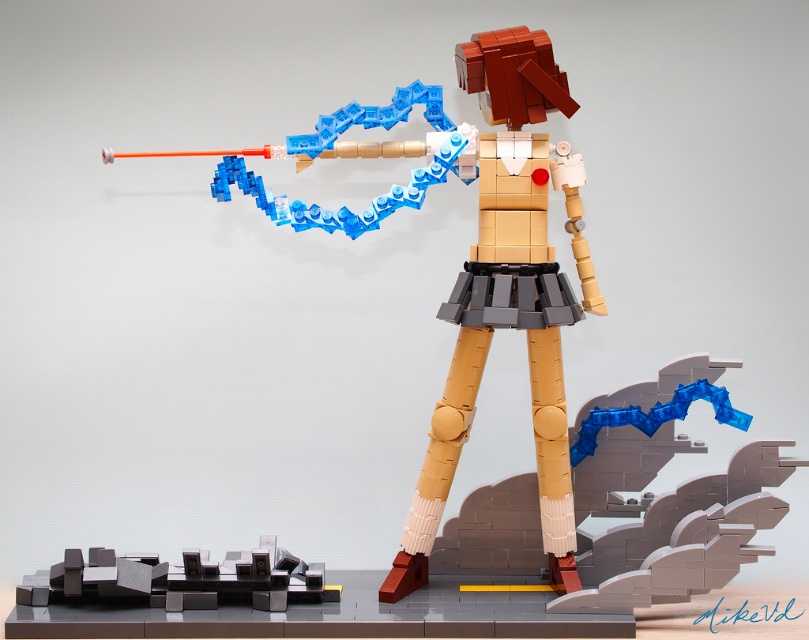
Looking at this image, you are a delivery drone with a 12 inch wingspan. You need to fly from the matte brown figure at center to the dark gray plastic cityscape at lower left. Can you fit through the space between them?

The distance between the matte brown figure at center and the dark gray plastic cityscape at lower left is 16.76 inches. Since your wingspan is 12 inches, you can safely fly through the space between them as the distance is greater than your wingspan.

You are a photographer standing at a certain distance from the matte brown figure at center. You want to take a closeup shot of the figure without any distortion. Considering the camera you have can focus clearly up to 2 meters, will you be able to capture a clear image?

The matte brown figure at center is 2.38 meters from the viewer, which is beyond the camera lens focus range of 2 meters. Therefore, the photographer cannot capture a clear closeup shot without moving closer.